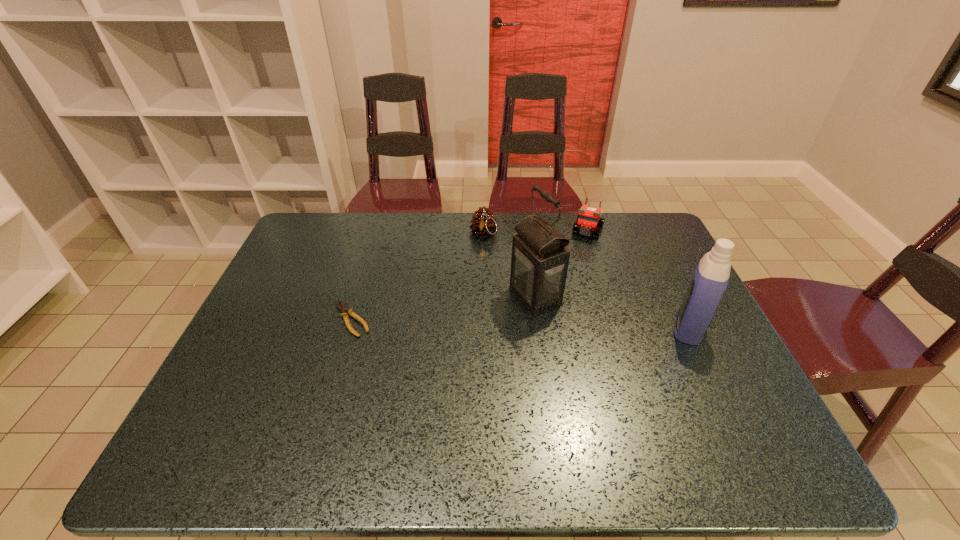
Where is `free point between the detergent and the Lego`? This screenshot has width=960, height=540. free point between the detergent and the Lego is located at coordinates (638, 279).

This screenshot has width=960, height=540. I want to click on unoccupied position between the leftmost object and the tallest object, so click(444, 308).

The height and width of the screenshot is (540, 960). Find the location of `free spot between the fourth shortest object and the pliers`. free spot between the fourth shortest object and the pliers is located at coordinates (520, 323).

Locate an element on the screen. The height and width of the screenshot is (540, 960). free space between the rightmost object and the leftmost object is located at coordinates (520, 323).

Locate an element on the screen. This screenshot has width=960, height=540. free space between the tallest object and the leftmost object is located at coordinates (444, 308).

At what (x,y) coordinates should I click in order to perform the action: click on free space between the fourth shortest object and the second object from right to left. Please return your answer as a coordinate pair (x, y). Image resolution: width=960 pixels, height=540 pixels. Looking at the image, I should click on (638, 279).

Select which object appears as the second closest to the third object from left to right. Please provide its 2D coordinates. Your answer should be formatted as a tuple, i.e. [(x, y)], where the tuple contains the x and y coordinates of a point satisfying the conditions above.

[(588, 221)]

You are a GUI agent. You are given a task and a screenshot of the screen. Output one action in this format:
    pyautogui.click(x=<x>, y=<y>)
    Task: Click on the object that stands as the closest to the rightmost object
    
    Given the screenshot: What is the action you would take?
    pyautogui.click(x=539, y=263)